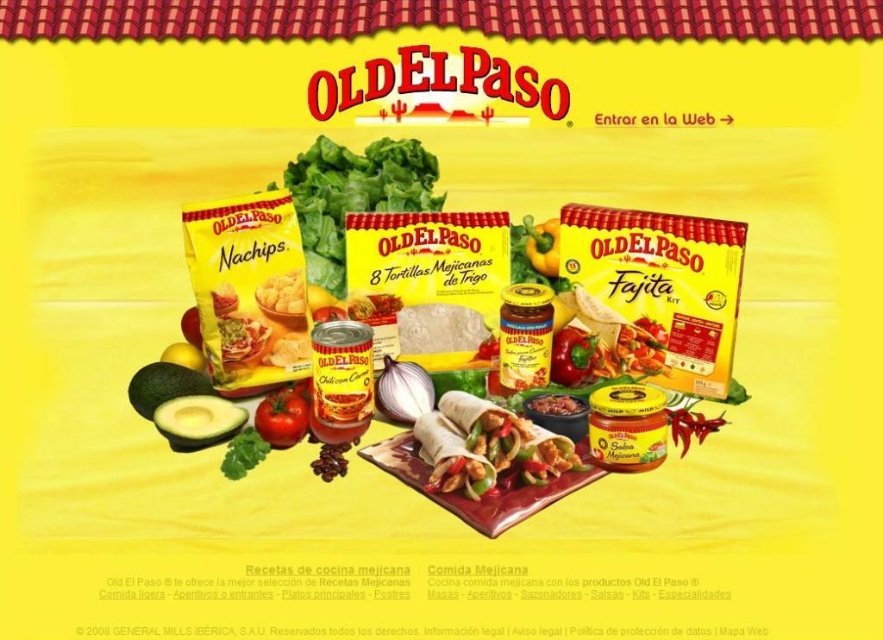
Which is below, yellow glass jar at center or green leafy at center?

green leafy at center

Which of these two, yellow glass jar at center or green leafy at center, stands taller?

yellow glass jar at center is taller.

I want to click on yellow glass jar at center, so click(x=525, y=336).

Can you confirm if yellow glass jar at center is positioned to the left of white matte onion at center?

In fact, yellow glass jar at center is to the right of white matte onion at center.

The image size is (883, 640). Identify the location of yellow glass jar at center. (525, 336).

Which is more to the left, green leafy lettuce at center or red glossy bell pepper at center?

green leafy lettuce at center is more to the left.

Measure the distance between green leafy lettuce at center and red glossy bell pepper at center.

green leafy lettuce at center is 41.38 centimeters from red glossy bell pepper at center.

Which is in front, point (308, 266) or point (580, 369)?

Point (580, 369)

The width and height of the screenshot is (883, 640). What are the coordinates of `green leafy lettuce at center` in the screenshot? It's located at (353, 195).